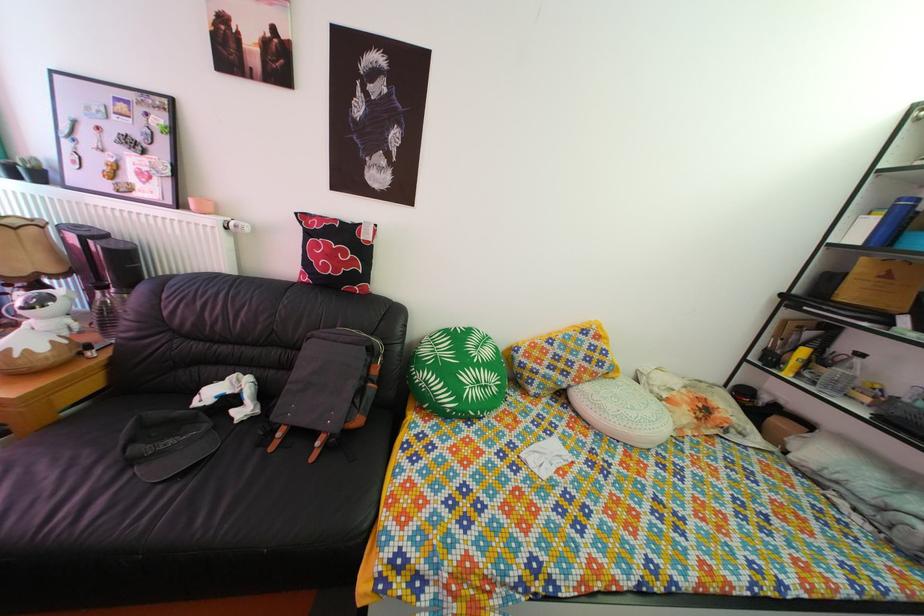
The width and height of the screenshot is (924, 616). What do you see at coordinates (103, 310) in the screenshot? I see `a clear water bottle` at bounding box center [103, 310].